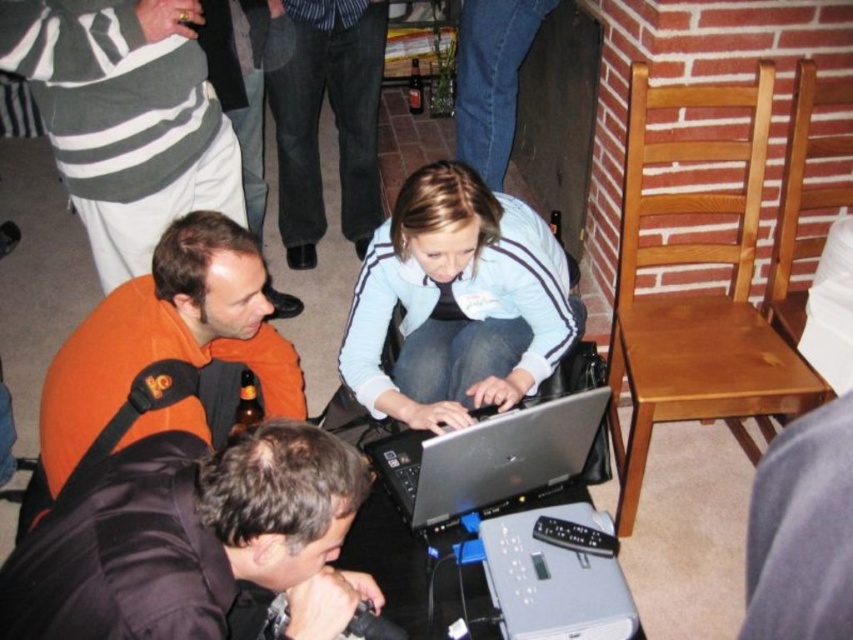
Which is below, orange fleece jacket at lower left or silver metallic laptop at center?

Positioned lower is silver metallic laptop at center.

Between point (161, 262) and point (492, 483), which one is positioned behind?

Point (161, 262)

Image resolution: width=853 pixels, height=640 pixels. Identify the location of orange fleece jacket at lower left. (167, 337).

The image size is (853, 640). What do you see at coordinates (457, 301) in the screenshot?
I see `light blue fabric jacket at center` at bounding box center [457, 301].

Which is in front, point (444, 337) or point (498, 541)?

Point (498, 541) is in front.

Where is `light blue fabric jacket at center`? light blue fabric jacket at center is located at coordinates pyautogui.click(x=457, y=301).

Is black matte jacket at lower left below light blue fabric jacket at center?

Indeed, black matte jacket at lower left is positioned under light blue fabric jacket at center.

Is the position of black matte jacket at lower left more distant than that of light blue fabric jacket at center?

No.

Between point (317, 541) and point (514, 362), which one is positioned behind?

The point (514, 362) is behind.

I want to click on black matte jacket at lower left, so click(194, 540).